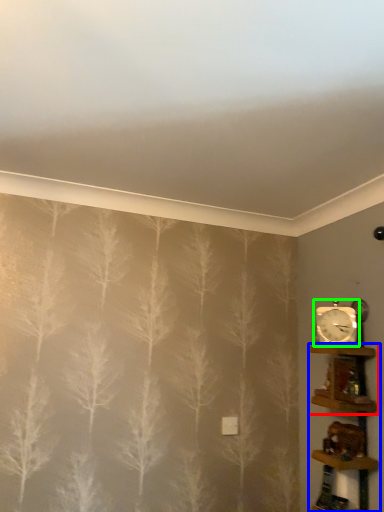
Question: Which object is positioned farthest from shelf (highlighted by a red box)? Select from shelf (highlighted by a blue box) and clock (highlighted by a green box).

Choices:
 (A) shelf
 (B) clock

Answer: (B)